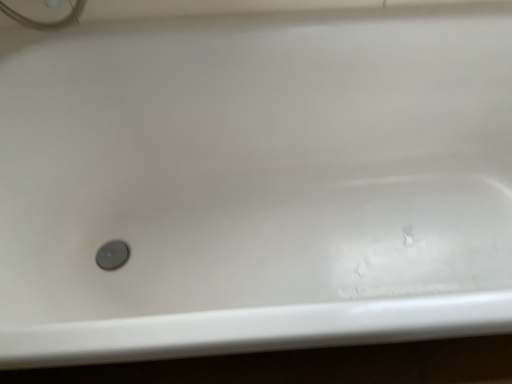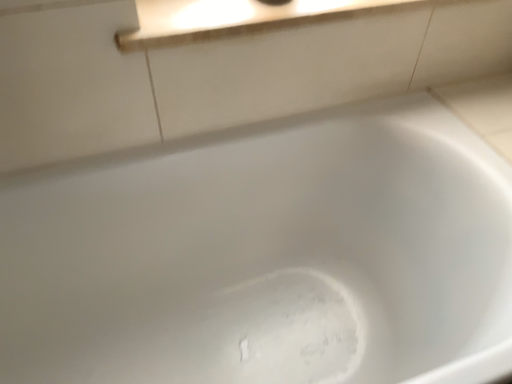
Question: Which way did the camera rotate in the video?

Choices:
 (A) rotated upward
 (B) rotated downward

Answer: (A)